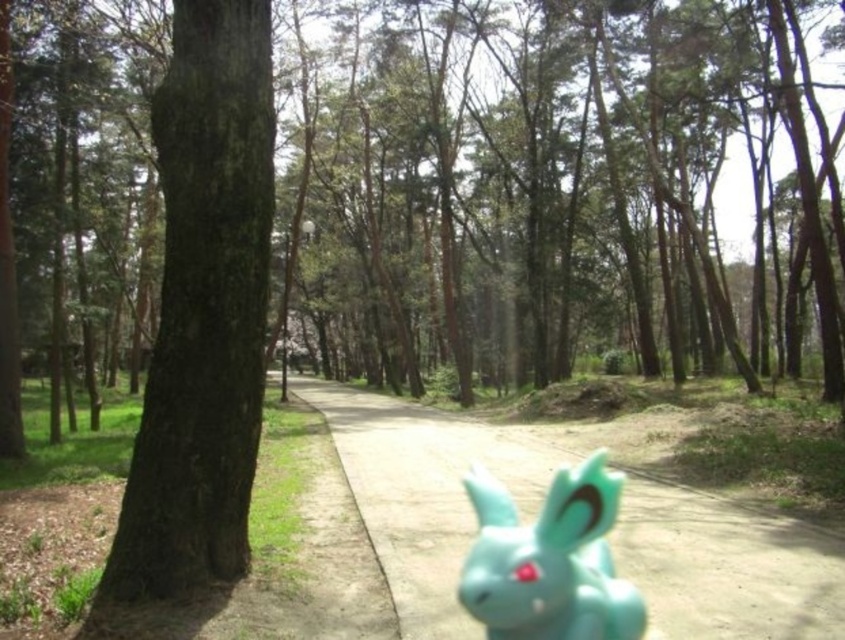
You are a hiker standing on the pathway and want to reach the teal matte bunny at center. Which direction should you walk to get closer to it while avoiding the dark brown bark tree at left?

The dark brown bark tree at left is closer to you than the teal matte bunny at center. To reach the teal matte bunny at center, you should walk away from the dark brown bark tree at left along the pathway, which curves gently to the right, to get closer to the teal matte bunny at center.

You are standing at the starting point of the forest path and see two points marked in the scene. Which point, point (140, 499) or point (456, 557), is closer to you?

Point (140, 499) is closer to the viewer than point (456, 557).

You are standing at the center of the pathway in the forest scene. You want to take a photo of the dark brown bark tree at left. To ensure the tree is in the frame, where should you position yourself relative to the tree?

The dark brown bark tree at left is located at point 2D coordinates (203,308). Since you are standing at the center of the pathway, you should position yourself to the right of the tree to ensure it is captured in the frame.